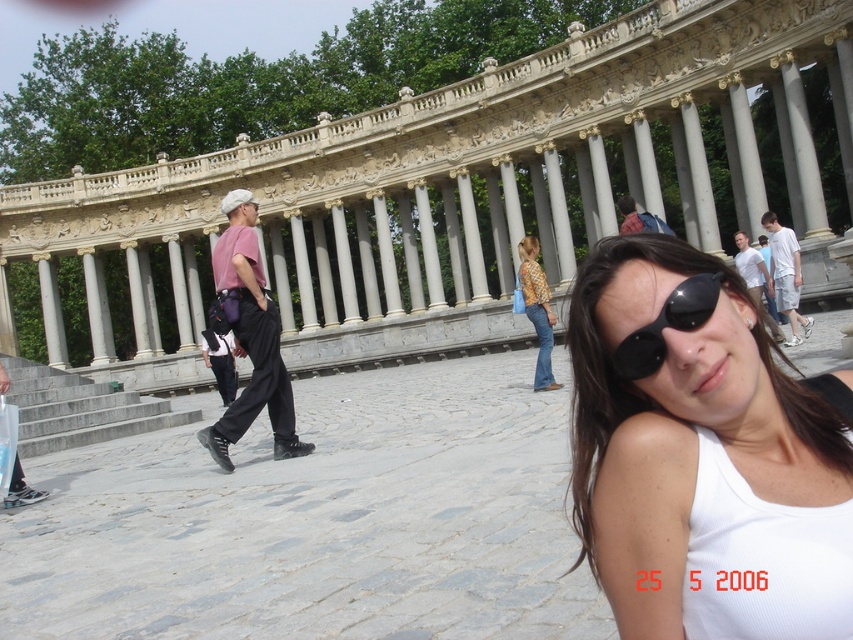
You are a photographer trying to capture a clear shot of the woman in the scene. The white matte tank top at center and the black reflective sunglasses at center are both important elements. Considering their positions, which one is more likely to be in focus if you adjust your camera to focus on the woman?

The white matte tank top at center is more likely to be in focus because it is part of the woman herself, whereas the black reflective sunglasses at center are an accessory worn on her face. Since the camera is focused on the woman, the tank top would naturally be in focus along with her body.

You are standing at the center of the plaza and see the matte pink shirt at left. If you want to walk directly towards it, which direction should you face? Please provide your answer as a coordinate direction based on the image coordinate system where the origin is at the bottom left corner of the image.

To walk directly towards the matte pink shirt at left located at coordinate point (250, 337), you should face the direction of that coordinate from your current position at the center of the image.

You are standing in the plaza and see the matte pink shirt at left and the black reflective sunglasses at center. Which object is positioned higher in the image?

The matte pink shirt at left is located above the black reflective sunglasses at center, so it is positioned higher in the image.